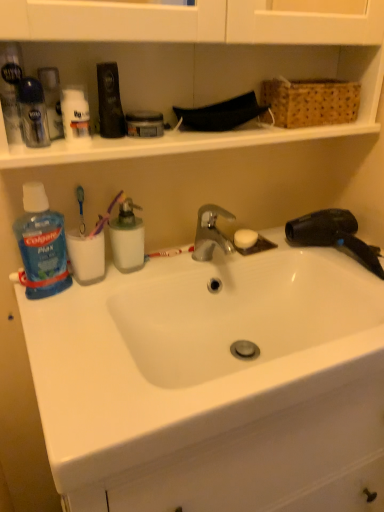
Where is `vacant region to the right of blue plastic mouthwash at left, the second cleaning product viewed from the right`? vacant region to the right of blue plastic mouthwash at left, the second cleaning product viewed from the right is located at coordinates (115, 292).